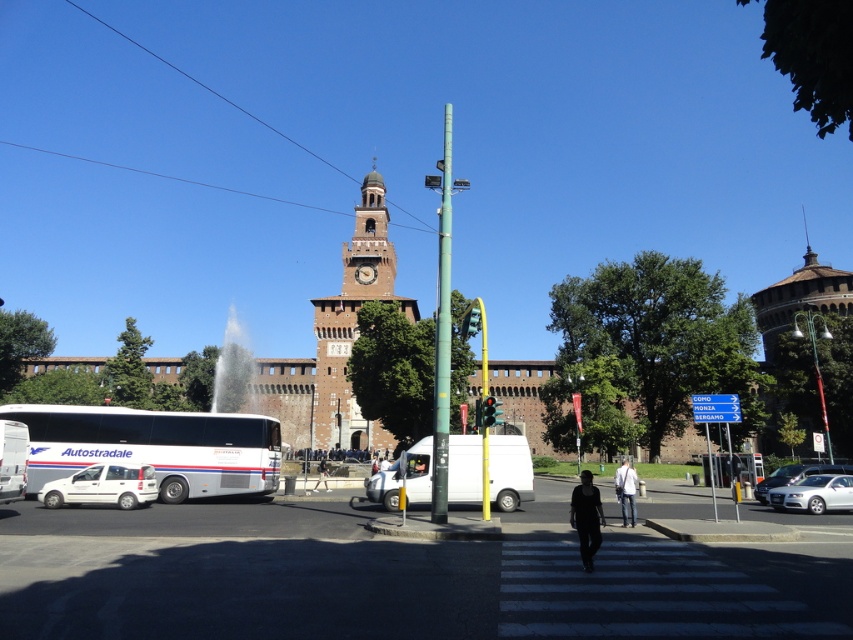
Does green painted metal pole at center have a greater height compared to silver metallic sedan at lower right?

Indeed, green painted metal pole at center has a greater height compared to silver metallic sedan at lower right.

Is point (437, 460) farther from viewer compared to point (833, 492)?

No, (437, 460) is in front of (833, 492).

Which is behind, point (450, 332) or point (804, 480)?

Point (804, 480)

This screenshot has width=853, height=640. I want to click on green painted metal pole at center, so click(x=442, y=330).

Is green painted metal pole at center thinner than dark gray fabric jacket at center?

Yes.

Is green painted metal pole at center to the left of dark gray fabric jacket at center from the viewer's perspective?

Yes, green painted metal pole at center is to the left of dark gray fabric jacket at center.

Does point (434, 337) come farther from viewer compared to point (573, 524)?

Yes, point (434, 337) is behind point (573, 524).

Find the location of a particular element. green painted metal pole at center is located at coordinates (442, 330).

Between silver metallic sedan at lower right and green metallic pole at center, which one is positioned lower?

Positioned lower is silver metallic sedan at lower right.

Is point (799, 481) closer to viewer compared to point (485, 332)?

Yes, point (799, 481) is closer to viewer.

Does point (828, 474) come farther from viewer compared to point (477, 296)?

No, (828, 474) is in front of (477, 296).

This screenshot has height=640, width=853. I want to click on silver metallic sedan at lower right, so click(814, 493).